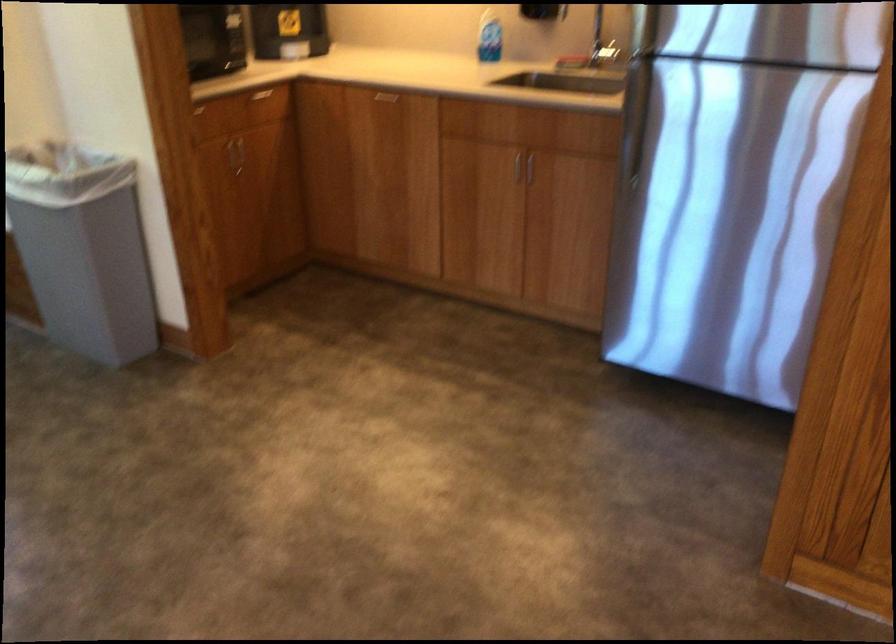
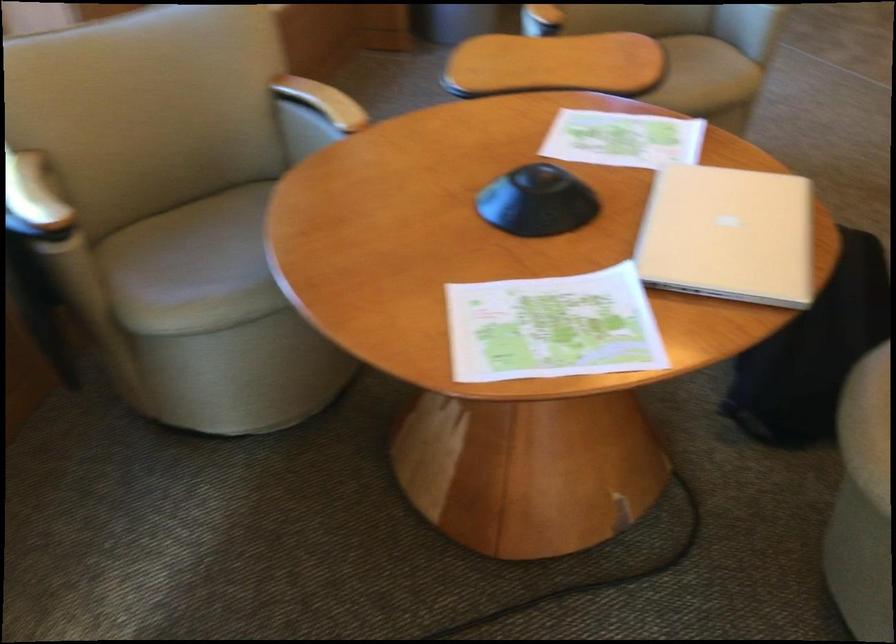
The images are taken continuously from a first-person perspective. In which direction are you moving?

The movement direction of the cameraman is left, backward.